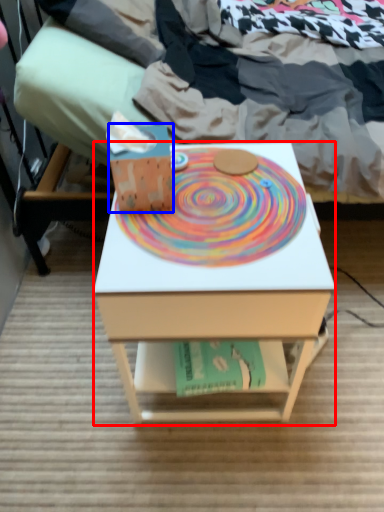
Question: Which point is further to the camera, desk (highlighted by a red box) or box (highlighted by a blue box)?

Choices:
 (A) desk
 (B) box

Answer: (B)